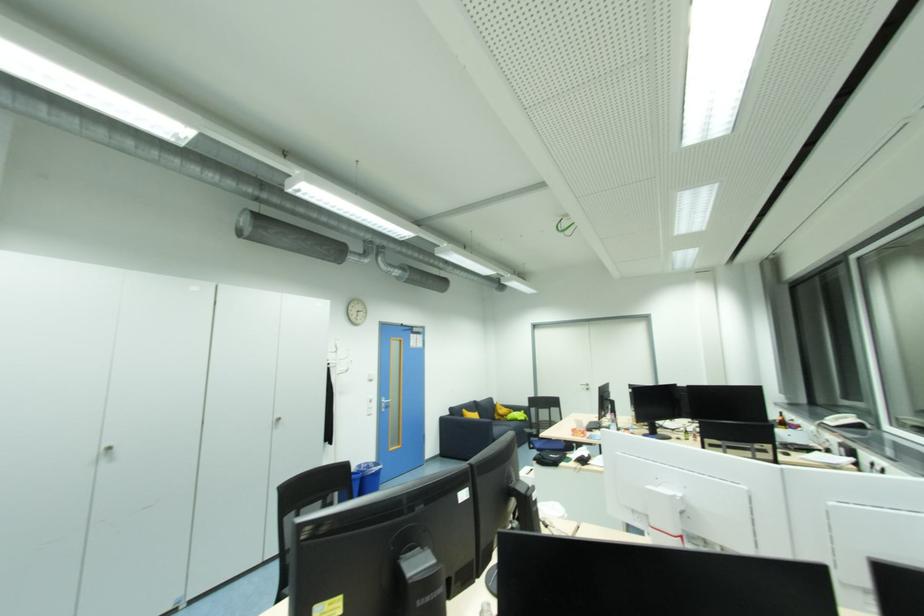
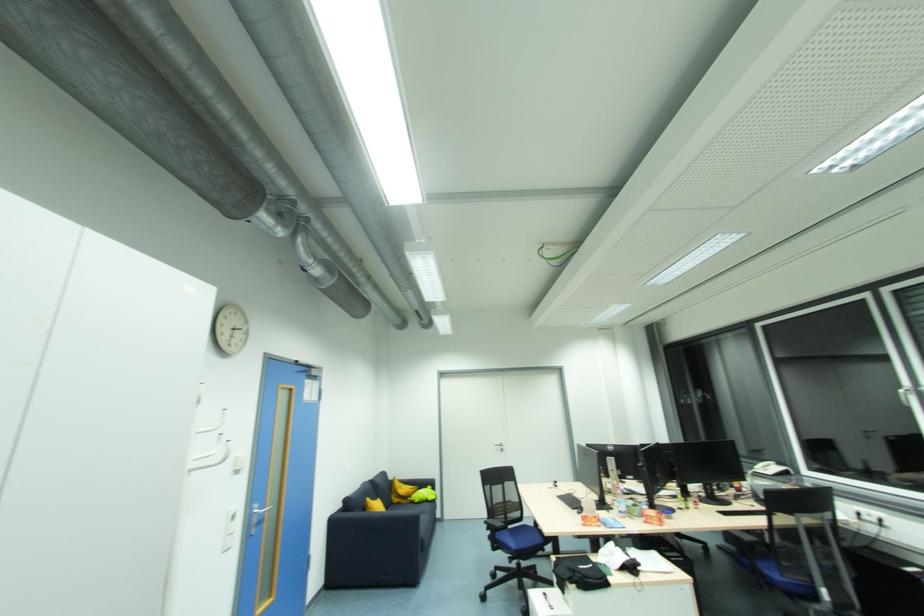
The point at (x=509, y=418) is marked in the first image. Where is the corresponding point in the second image?

(412, 499)